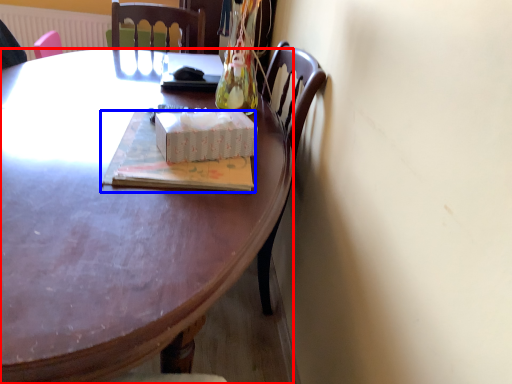
Question: Which of the following is the farthest to the observer, desk (highlighted by a red box) or book (highlighted by a blue box)?

Choices:
 (A) desk
 (B) book

Answer: (B)